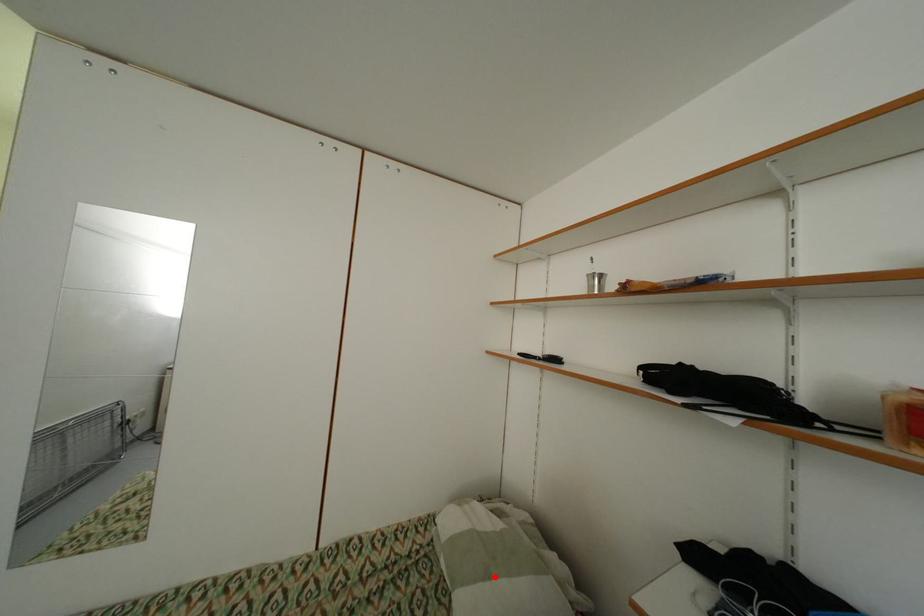
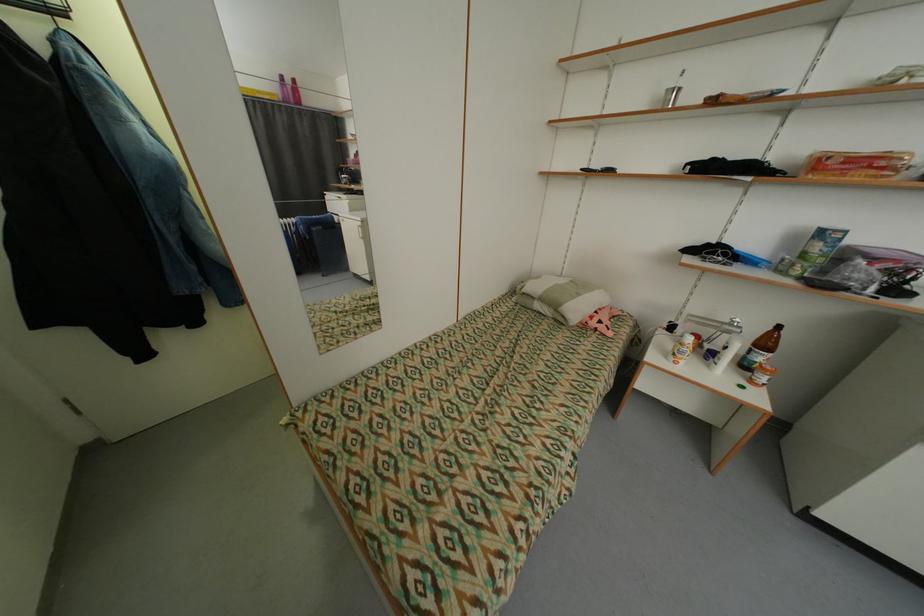
In the second image, find the point that corresponds to the highlighted location in the first image.

(585, 296)